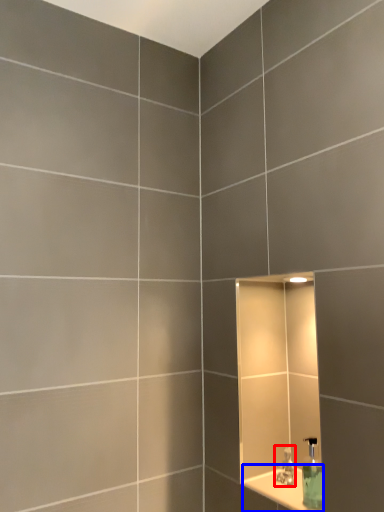
Question: Which of the following is the closest to the observer, tap (highlighted by a red box) or ledge (highlighted by a blue box)?

Choices:
 (A) tap
 (B) ledge

Answer: (B)